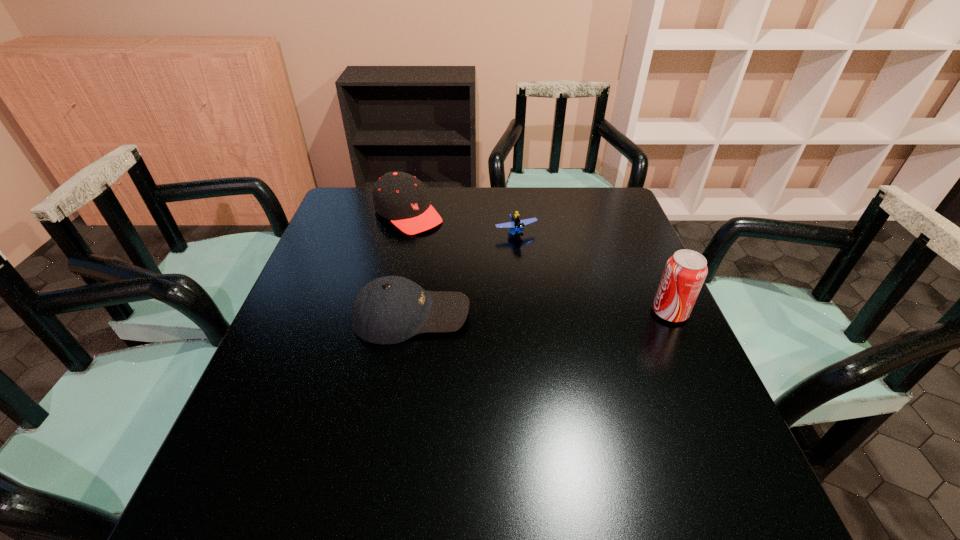
You are a GUI agent. You are given a task and a screenshot of the screen. Output one action in this format:
    pyautogui.click(x=<x>, y=<y>)
    Task: Click on the free region that satisfies the following two spatial constraints: 1. on the front side of the third tallest object; 2. on the front-facing side of the cap
    
    Given the screenshot: What is the action you would take?
    coord(386,315)

Locate an element on the screen. The height and width of the screenshot is (540, 960). vacant space that satisfies the following two spatial constraints: 1. on the front side of the shortest object; 2. on the left side of the second tallest object is located at coordinates [x=404, y=233].

Where is `vacant space that satisfies the following two spatial constraints: 1. on the front side of the third tallest object; 2. on the front-facing side of the cap`? This screenshot has height=540, width=960. vacant space that satisfies the following two spatial constraints: 1. on the front side of the third tallest object; 2. on the front-facing side of the cap is located at coordinates (386, 315).

You are a GUI agent. You are given a task and a screenshot of the screen. Output one action in this format:
    pyautogui.click(x=<x>, y=<y>)
    Task: Click on the blank area in the image that satisfies the following two spatial constraints: 1. on the front side of the shortest object; 2. on the logo side of the rightmost object
    This screenshot has height=540, width=960.
    Given the screenshot: What is the action you would take?
    click(x=524, y=312)

The width and height of the screenshot is (960, 540). Find the location of `free location that satisfies the following two spatial constraints: 1. on the front side of the third tallest object; 2. on the front-facing side of the second tallest object`. free location that satisfies the following two spatial constraints: 1. on the front side of the third tallest object; 2. on the front-facing side of the second tallest object is located at coordinates (386, 315).

The width and height of the screenshot is (960, 540). I want to click on vacant space that satisfies the following two spatial constraints: 1. on the front side of the tallest object; 2. on the logo side of the third object from left to right, so click(524, 312).

The image size is (960, 540). What are the coordinates of `vacant region that satisfies the following two spatial constraints: 1. on the front side of the baseball cap; 2. on the front-facing side of the second tallest object` in the screenshot? It's located at (386, 315).